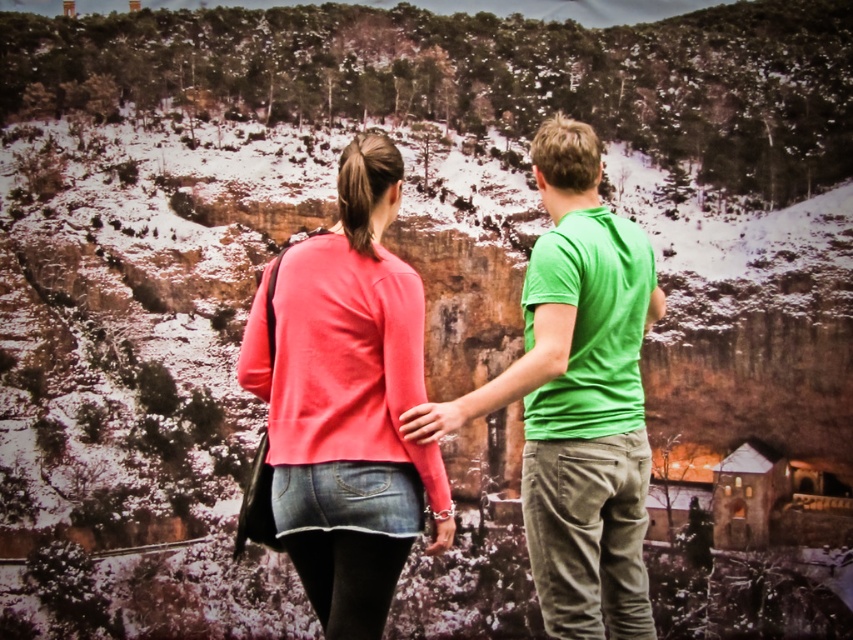
You are a photographer trying to capture the scene with the two individuals and the scenic landscape. You notice the coral matte sweater at center in the image. Based on its coordinates, where exactly is the coral matte sweater positioned relative to the two people?

The coral matte sweater at center is located at point coordinates 0.628 on the x axis and 0.408 on the y axis, so it is positioned to the right and slightly below the center of the image.